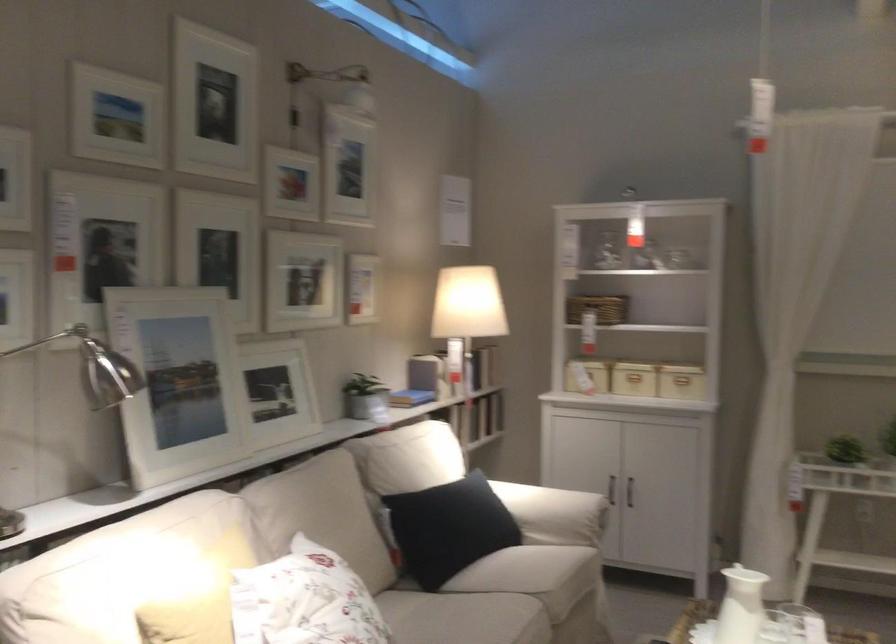
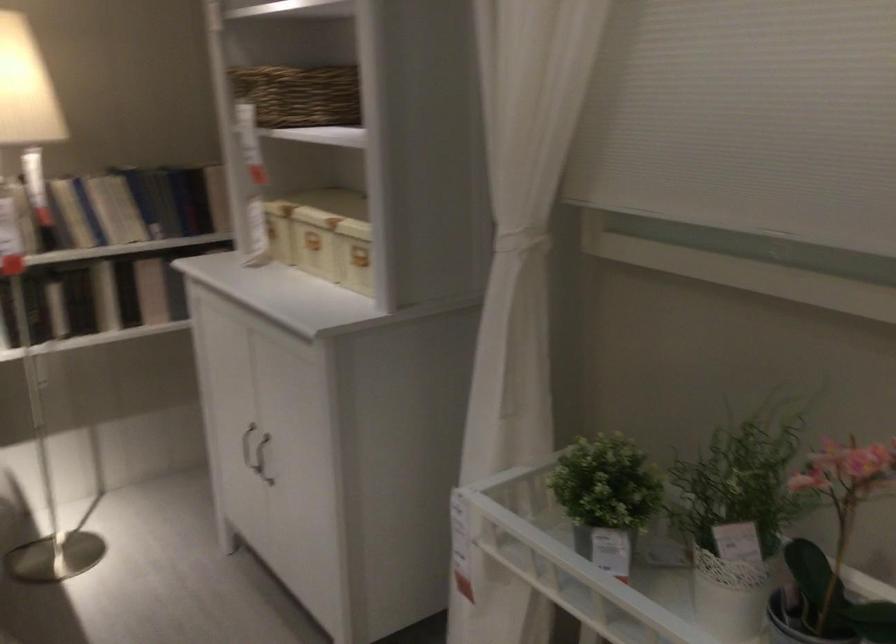
The point at (484, 415) is marked in the first image. Where is the corresponding point in the second image?

(151, 290)